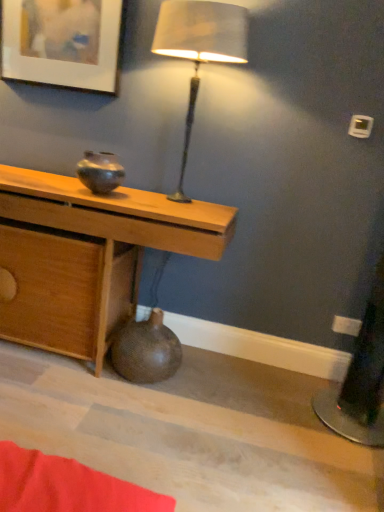
Locate an element on the screen. Image resolution: width=384 pixels, height=512 pixels. vacant space to the right of wooden desk at center is located at coordinates [253, 416].